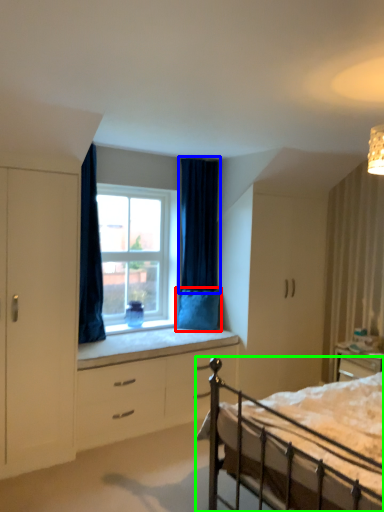
Question: Which object is positioned closest to pillow (highlighted by a red box)? Select from curtain (highlighted by a blue box) and bed (highlighted by a green box).

Choices:
 (A) curtain
 (B) bed

Answer: (A)